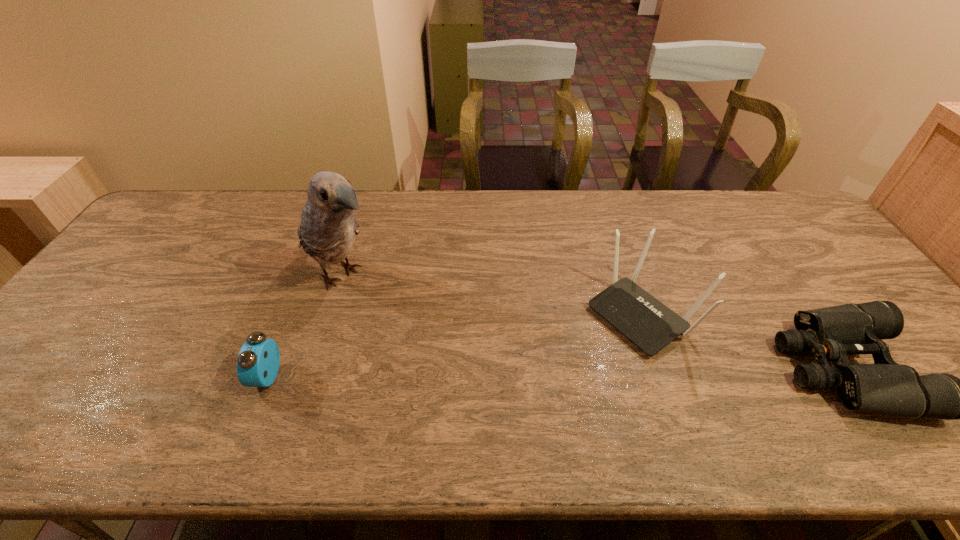
I want to click on object at the right edge, so click(832, 333).

The width and height of the screenshot is (960, 540). In order to click on object situated at the near right corner in this screenshot , I will do `click(832, 333)`.

This screenshot has height=540, width=960. I want to click on vacant area at the far edge of the desktop, so click(x=622, y=230).

Locate an element on the screen. The height and width of the screenshot is (540, 960). vacant space at the near edge is located at coordinates (152, 387).

Locate an element on the screen. The height and width of the screenshot is (540, 960). vacant region at the left edge of the desktop is located at coordinates coord(72,327).

The width and height of the screenshot is (960, 540). Find the location of `vacant space at the right edge of the desktop`. vacant space at the right edge of the desktop is located at coordinates pos(870,356).

In the image, there is a desktop. What are the coordinates of `free region at the far left corner` in the screenshot? It's located at (186, 211).

Find the location of a particular element. The width and height of the screenshot is (960, 540). unoccupied position between the router and the binoculars is located at coordinates (744, 341).

What are the coordinates of `free space between the second tallest object and the parrot` in the screenshot? It's located at (492, 295).

Where is `free space between the router and the third tallest object`? The width and height of the screenshot is (960, 540). free space between the router and the third tallest object is located at coordinates (455, 345).